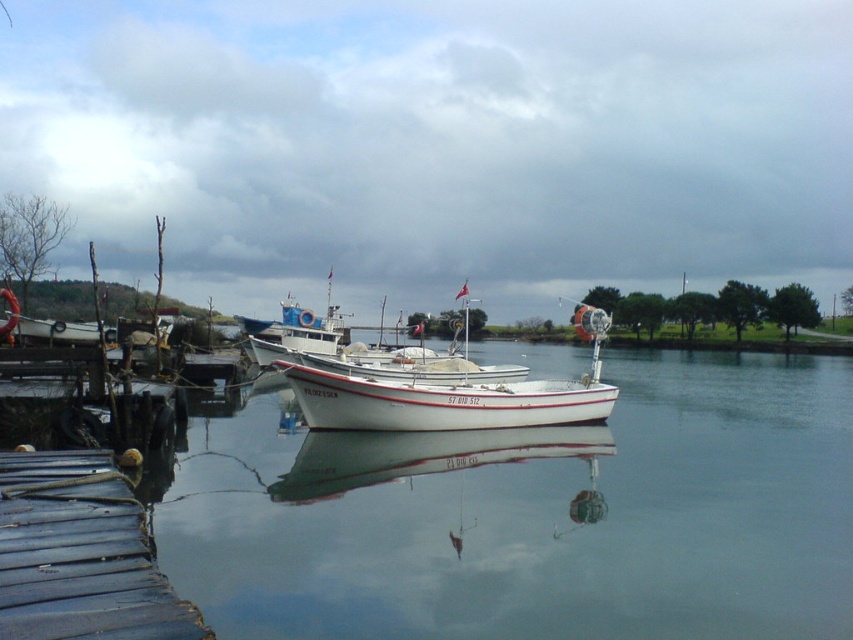
You are standing on the dark blue wooden dock at lower left and want to board the white matte boat at center. Which direction should you move to reach the boat?

The dark blue wooden dock at lower left is in front of the white matte boat at center, so you should move backward to reach the boat.

From the picture: You are standing at the point with coordinates point (280,365) and want to walk towards the point with coordinates point (3,490). Based on the scene, will you be walking towards the waterfront or away from it?

Since point (3,490) is in front of point (280,365), you will be walking towards the waterfront.

You are standing on the dark blue wooden dock at lower left and want to move to the white matte boat at center. Which direction should you go to reach the boat?

Since the dark blue wooden dock at lower left is larger in size than the white matte boat at center, you should move towards the center of the image to reach the boat.